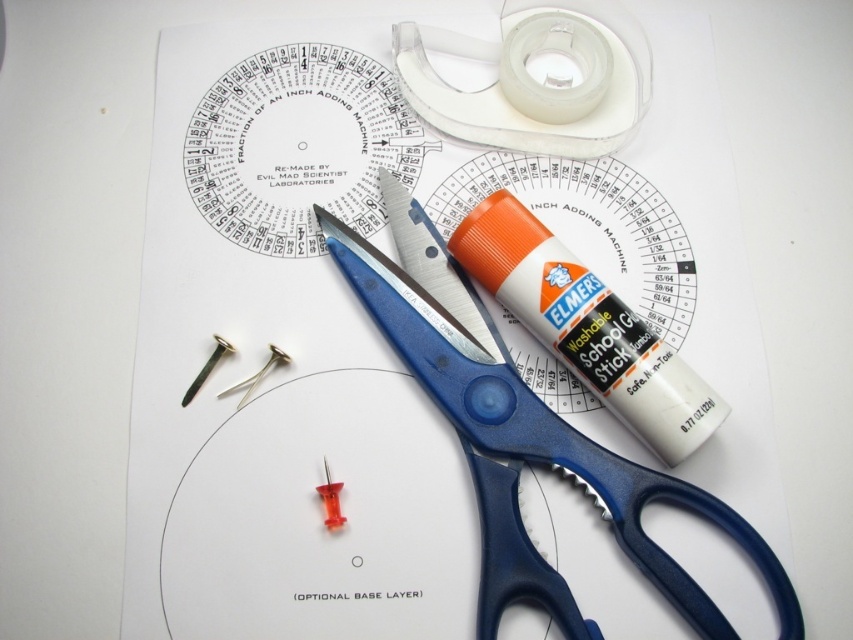
You need to place both the blue plastic scissors at upper center and the transparent plastic tape at upper center into a storage box that can only accommodate items up to 12 centimeters in width. Based on their widths, can both items fit side by side?

The blue plastic scissors at upper center might be wider than transparent plastic tape at upper center. However, without exact measurements, it is uncertain if both can fit within the 12 centimeter limit. Check their actual widths to confirm.

You are standing 5 feet away from the white surface where the crafting tools are laid out. You need to reach the transparent plastic tape at upper right. Can you grab it without moving your position?

The transparent plastic tape at upper right is 4.20 feet away from camera. Since you are standing 5 feet away from the white surface, the distance between you and the tape is more than 5 feet, so you cannot reach it without moving.

You are organizing the crafting tools on the table. You need to place a new glue stick between the blue plastic scissors at upper center and the transparent plastic tape at upper center. Is there enough space between them to fit the glue stick?

The blue plastic scissors at upper center is to the left of transparent plastic tape at upper center, so there is space between them to place the glue stick.